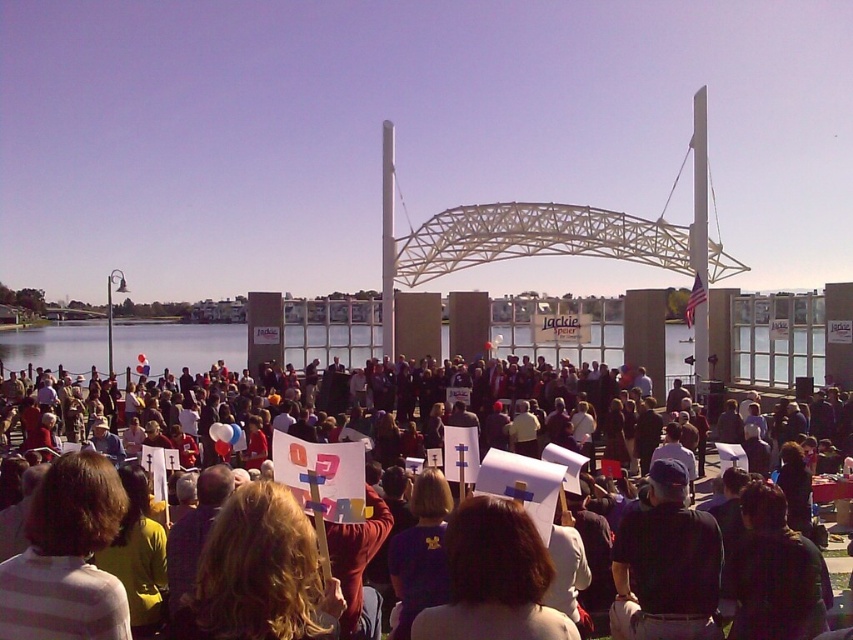
Does white paper signs at center have a greater height compared to dark blue fabric at center?

Correct, white paper signs at center is much taller as dark blue fabric at center.

Which is behind, point (697, 540) or point (618, 618)?

The point (697, 540) is behind.

Where is `white paper signs at center`? white paper signs at center is located at coordinates click(685, 564).